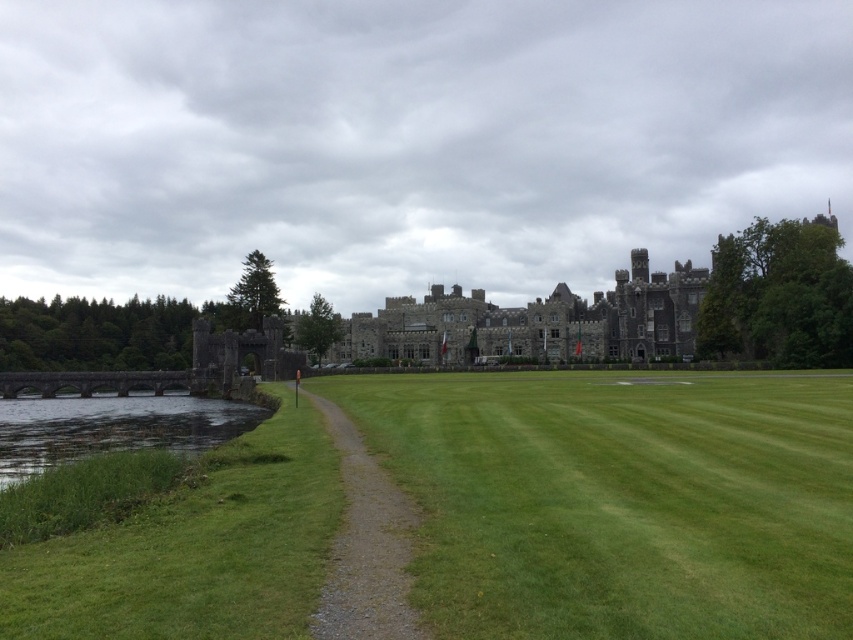
Is green grass at center to the right of green grassy water at lower left from the viewer's perspective?

Indeed, green grass at center is positioned on the right side of green grassy water at lower left.

Is green grass at center to the left of green grassy water at lower left from the viewer's perspective?

No, green grass at center is not to the left of green grassy water at lower left.

Is point (698, 428) positioned before point (73, 413)?

That is True.

Where is `green grass at center`? This screenshot has height=640, width=853. green grass at center is located at coordinates (619, 500).

Which is more to the right, gravel path at center or green grassy water at lower left?

From the viewer's perspective, gravel path at center appears more on the right side.

Is gravel path at center shorter than green grassy water at lower left?

In fact, gravel path at center may be taller than green grassy water at lower left.

Where is `gravel path at center`? The image size is (853, 640). gravel path at center is located at coordinates (364, 547).

Does green grass at center appear over gravel path at center?

Correct, green grass at center is located above gravel path at center.

Who is taller, green grass at center or gravel path at center?

With more height is green grass at center.

Find the location of a particular element. The height and width of the screenshot is (640, 853). green grass at center is located at coordinates (619, 500).